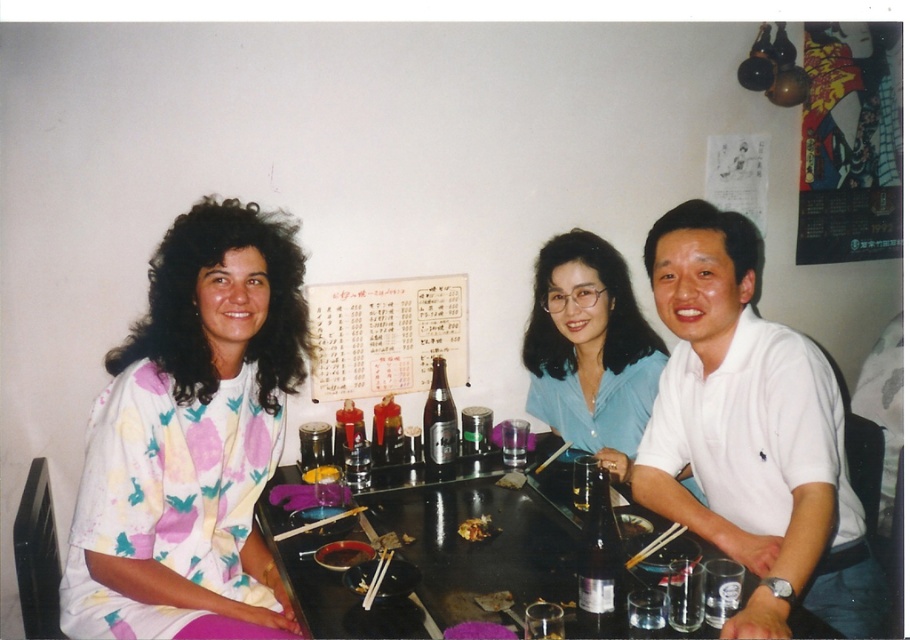
From the picture: You are a server at the restaurant and need to place a 30 cm wide tray between the pink floral shirt at left and the black glass table at center. Can you fit it without moving any existing items?

The distance between the pink floral shirt at left and the black glass table at center is 35.15 centimeters. Since the tray is 30 cm wide, it can fit as there is enough space.

You are sitting at the dining table in the restaurant and want to pass a napkin from the black glass table at center to the person in the pink floral shirt at left. Which direction should you move the napkin to reach them?

The black glass table at center is behind the pink floral shirt at left, so you should move the napkin forward towards the pink floral shirt at left to reach them.